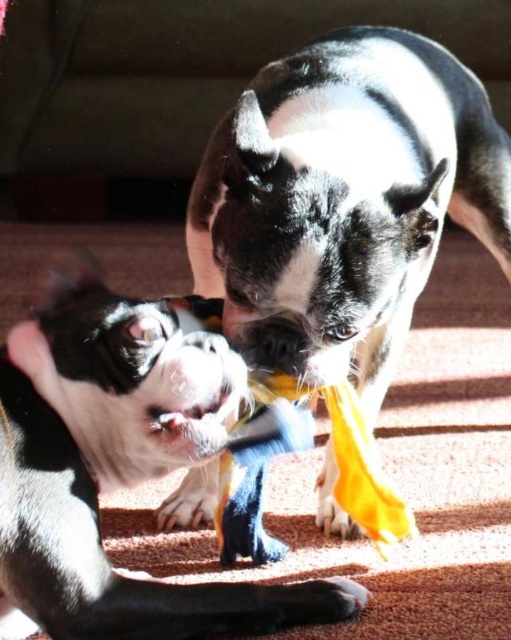
Does black and white fur at center have a smaller size compared to black matte dog at center?

No.

Consider the image. Which is below, black and white fur at center or black matte dog at center?

black matte dog at center is below.

Is point (220, 264) positioned before point (149, 353)?

That is False.

Image resolution: width=511 pixels, height=640 pixels. I want to click on black and white fur at center, so click(343, 200).

Is the position of black matte dog at center more distant than that of fuzzy white fur at center?

No, black matte dog at center is closer to the viewer.

Does black matte dog at center appear over fuzzy white fur at center?

Actually, black matte dog at center is below fuzzy white fur at center.

Describe the element at coordinates (115, 470) in the screenshot. This screenshot has width=511, height=640. I see `black matte dog at center` at that location.

This screenshot has width=511, height=640. Identify the location of black matte dog at center. (115, 470).

Does black and white fur at center have a smaller size compared to fuzzy white fur at center?

No.

Between point (385, 280) and point (222, 412), which one is positioned in front?

Point (385, 280) is more forward.

Which is behind, point (270, 356) or point (176, 428)?

Point (270, 356)

You are a GUI agent. You are given a task and a screenshot of the screen. Output one action in this format:
    pyautogui.click(x=<x>, y=<y>)
    Task: Click on the black and white fur at center
    
    Given the screenshot: What is the action you would take?
    pyautogui.click(x=343, y=200)